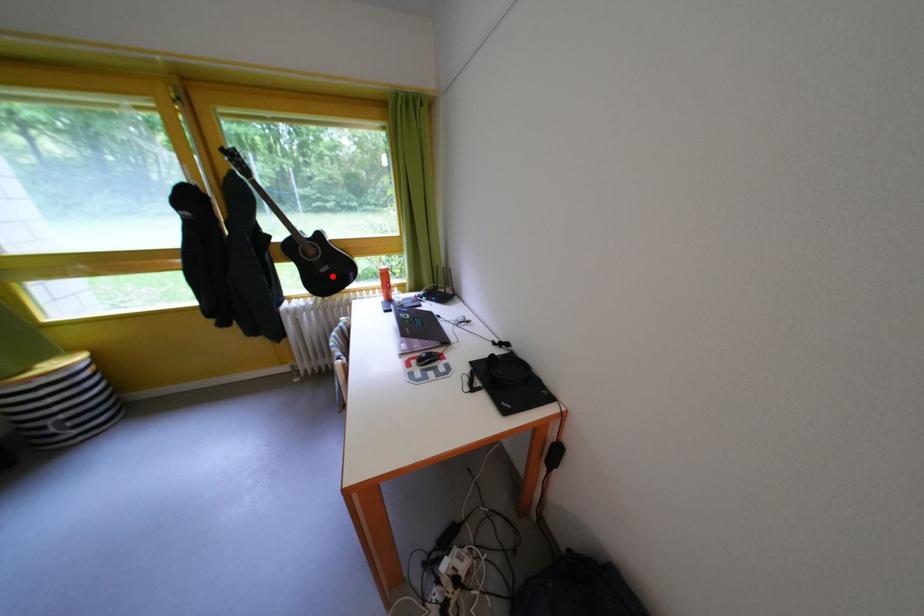
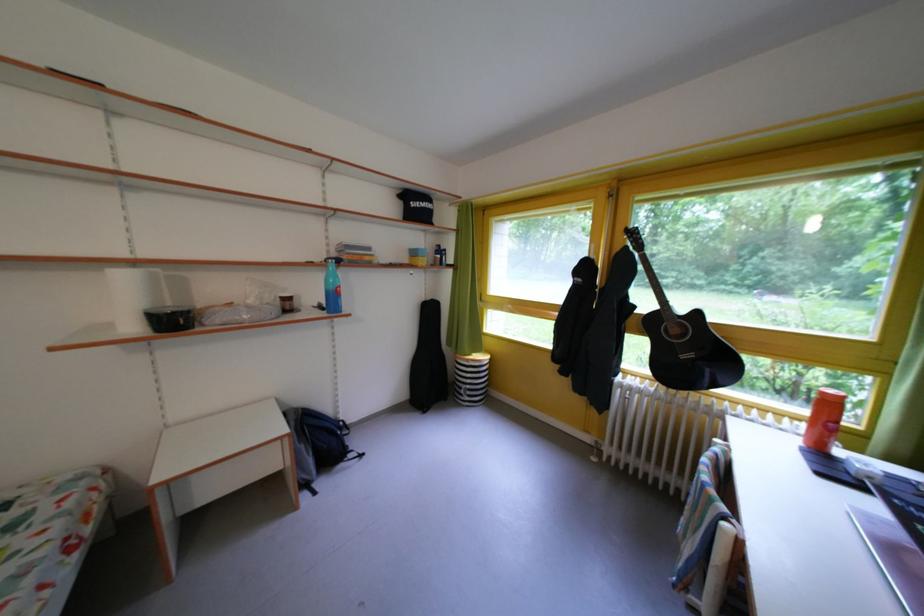
The point at the highlighted location is marked in the first image. Where is the corresponding point in the second image?

(693, 362)